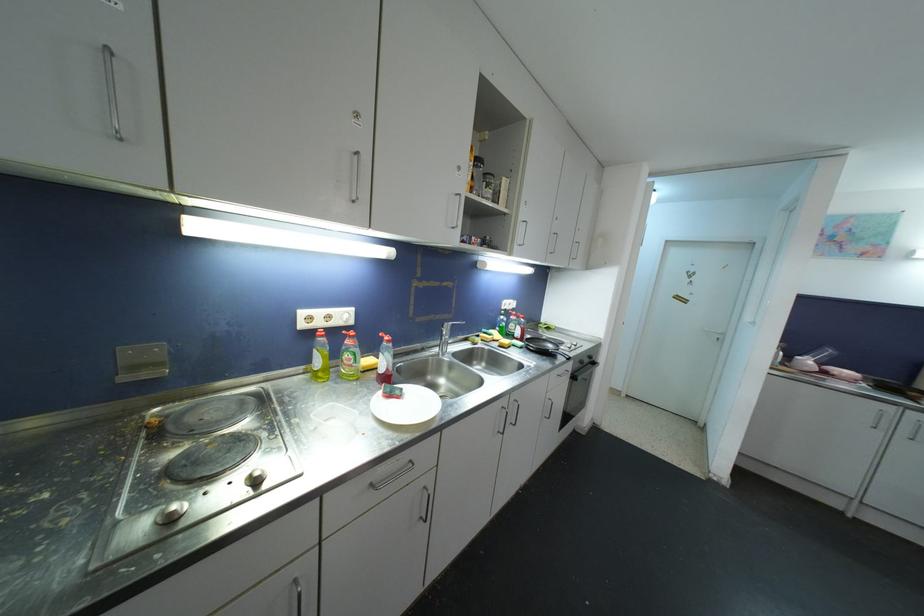
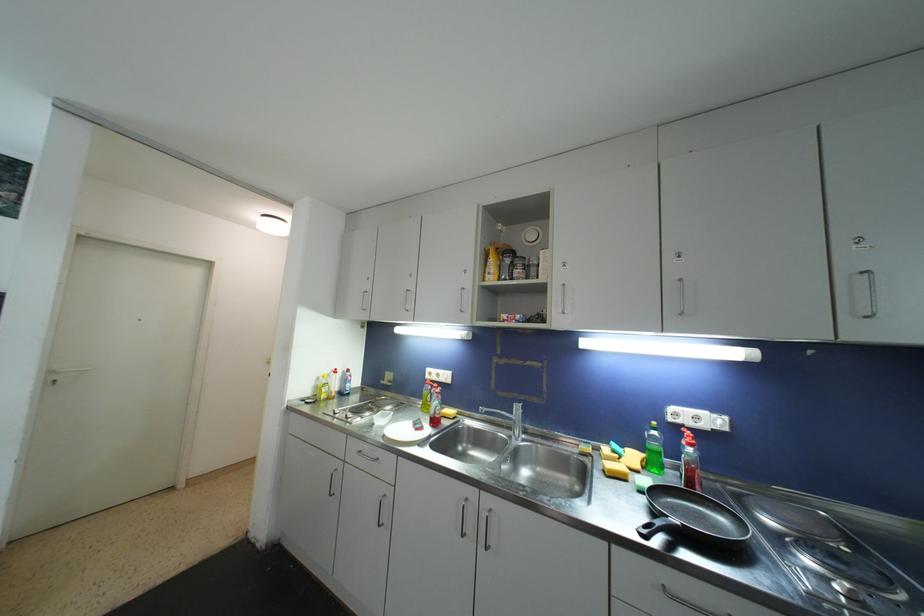
In the second image, find the point that corresponds to [505,320] in the first image.

(658, 436)